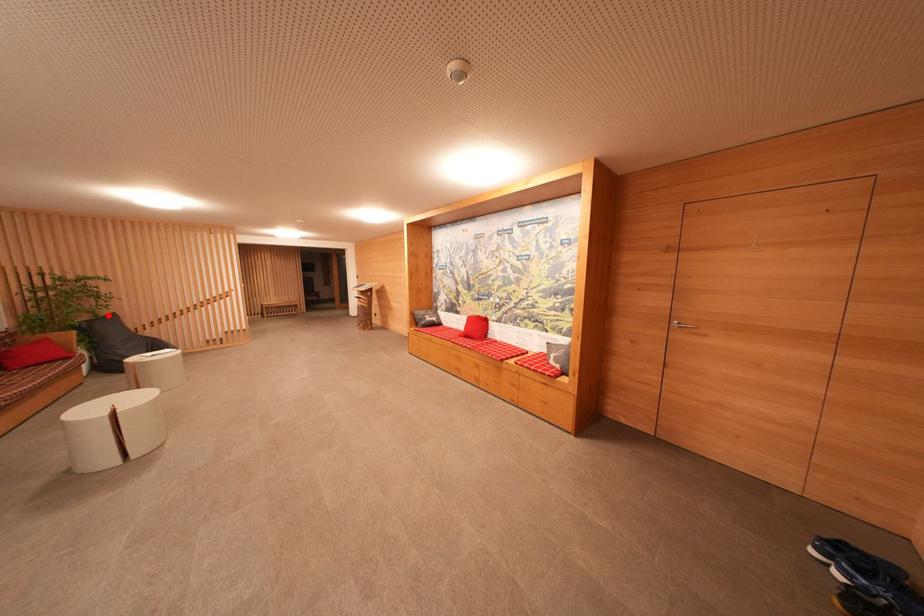
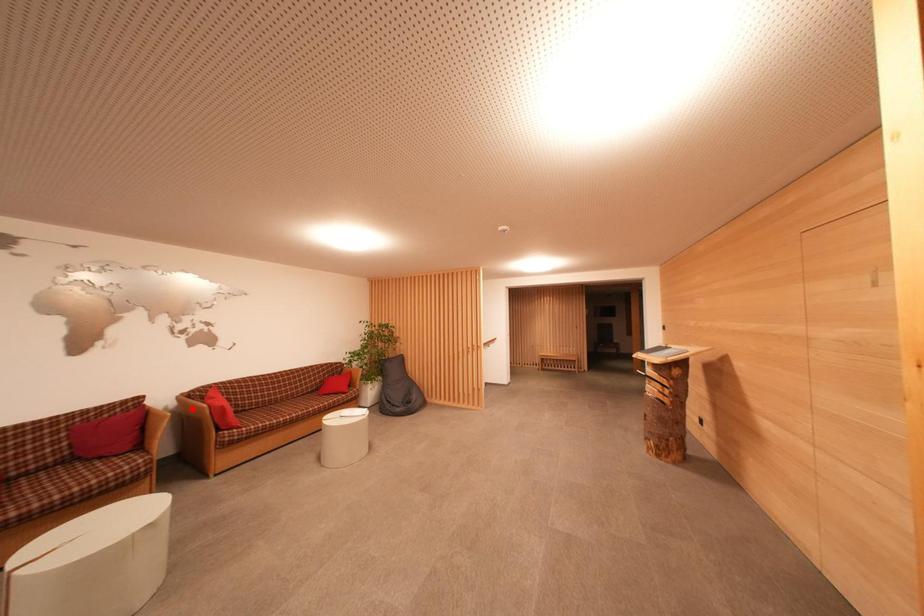
I am providing you with two images of the same scene from different viewpoints. A red point is marked on the first image and another point is marked on the second image. Does the point marked in image1 correspond to the same location as the one in image2?

No